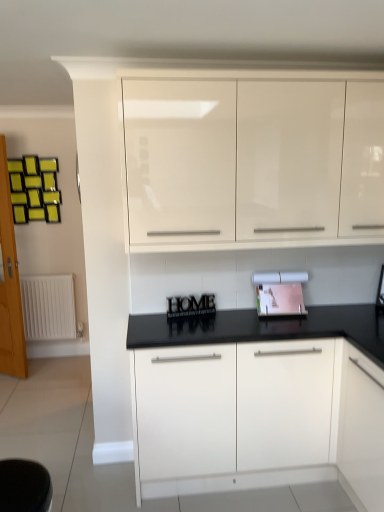
Question: Is glossy white cabinets at upper center, the first cabinetry in the top-to-bottom sequence, at the right side of white glossy cabinet at center, the first cabinetry from the bottom?

Choices:
 (A) no
 (B) yes

Answer: (A)

Question: From the image's perspective, is glossy white cabinets at upper center, the second cabinetry in the bottom-to-top sequence, beneath white glossy cabinet at center, the first cabinetry from the bottom?

Choices:
 (A) no
 (B) yes

Answer: (A)

Question: From a real-world perspective, is glossy white cabinets at upper center, the second cabinetry in the bottom-to-top sequence, located beneath white glossy cabinet at center, the first cabinetry from the bottom?

Choices:
 (A) no
 (B) yes

Answer: (A)

Question: Does glossy white cabinets at upper center, the second cabinetry in the bottom-to-top sequence, lie in front of white glossy cabinet at center, which appears as the 2th cabinetry when viewed from the top?

Choices:
 (A) no
 (B) yes

Answer: (B)

Question: From the image's perspective, is glossy white cabinets at upper center, the second cabinetry in the bottom-to-top sequence, on white glossy cabinet at center, which appears as the 2th cabinetry when viewed from the top?

Choices:
 (A) no
 (B) yes

Answer: (B)

Question: Considering the relative sizes of glossy white cabinets at upper center, the first cabinetry in the top-to-bottom sequence, and white glossy cabinet at center, which appears as the 2th cabinetry when viewed from the top, in the image provided, is glossy white cabinets at upper center, the first cabinetry in the top-to-bottom sequence, bigger than white glossy cabinet at center, which appears as the 2th cabinetry when viewed from the top,?

Choices:
 (A) yes
 (B) no

Answer: (B)

Question: From the image's perspective, is wooden letters at center located above white glossy cabinet at center, which appears as the 2th cabinetry when viewed from the top?

Choices:
 (A) yes
 (B) no

Answer: (A)

Question: Could you tell me if wooden letters at center is turned towards white glossy cabinet at center, which appears as the 2th cabinetry when viewed from the top?

Choices:
 (A) yes
 (B) no

Answer: (B)

Question: Does wooden letters at center have a larger size compared to white glossy cabinet at center, which appears as the 2th cabinetry when viewed from the top?

Choices:
 (A) yes
 (B) no

Answer: (B)

Question: Is wooden letters at center smaller than white glossy cabinet at center, the first cabinetry from the bottom?

Choices:
 (A) no
 (B) yes

Answer: (B)

Question: From a real-world perspective, is wooden letters at center located higher than white glossy cabinet at center, which appears as the 2th cabinetry when viewed from the top?

Choices:
 (A) yes
 (B) no

Answer: (A)

Question: Is wooden letters at center positioned before white glossy cabinet at center, the first cabinetry from the bottom?

Choices:
 (A) yes
 (B) no

Answer: (B)

Question: From the image's perspective, is matte pink paper at center on wooden glass door at left?

Choices:
 (A) no
 (B) yes

Answer: (A)